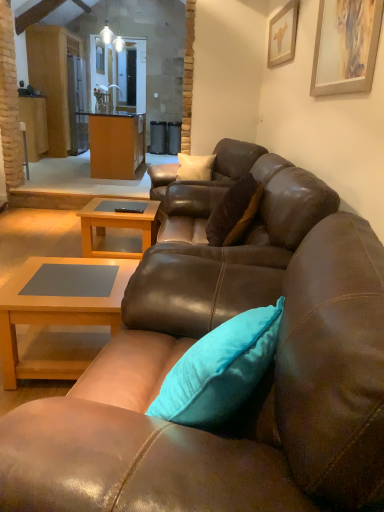
Question: Considering the relative sizes of wooden picture frame at upper right, which is the 1th picture frame from front to back, and wooden picture frame at upper right, which is the 2th picture frame in front-to-back order, in the image provided, is wooden picture frame at upper right, which is the 1th picture frame from front to back, thinner than wooden picture frame at upper right, which is the 2th picture frame in front-to-back order,?

Choices:
 (A) no
 (B) yes

Answer: (A)

Question: Considering the relative positions of wooden picture frame at upper right, the 1th picture frame positioned from the bottom, and wooden picture frame at upper right, the second picture frame ordered from the bottom, in the image provided, is wooden picture frame at upper right, the 1th picture frame positioned from the bottom, to the left of wooden picture frame at upper right, the second picture frame ordered from the bottom, from the viewer's perspective?

Choices:
 (A) no
 (B) yes

Answer: (A)

Question: From a real-world perspective, is wooden picture frame at upper right, placed as the second picture frame when sorted from back to front, under wooden picture frame at upper right, placed as the first picture frame when sorted from top to bottom?

Choices:
 (A) no
 (B) yes

Answer: (B)

Question: Would you say wooden picture frame at upper right, the 1th picture frame positioned from the bottom, contains wooden picture frame at upper right, placed as the first picture frame when sorted from top to bottom?

Choices:
 (A) no
 (B) yes

Answer: (A)

Question: Is wooden picture frame at upper right, the 1th picture frame positioned from the bottom, oriented away from wooden picture frame at upper right, placed as the first picture frame when sorted from top to bottom?

Choices:
 (A) yes
 (B) no

Answer: (B)

Question: Is wooden picture frame at upper right, placed as the second picture frame when sorted from back to front, to the right of wooden picture frame at upper right, the second picture frame ordered from the bottom, from the viewer's perspective?

Choices:
 (A) no
 (B) yes

Answer: (B)

Question: Can you confirm if brown leather couch at center, acting as the second studio couch starting from the top, is positioned to the left of light brown wood coffee table at center, which is the second coffee table in bottom-to-top order?

Choices:
 (A) no
 (B) yes

Answer: (A)

Question: Can you confirm if brown leather couch at center, which ranks as the 1th studio couch in bottom-to-top order, is wider than light brown wood coffee table at center, which is counted as the 1th coffee table, starting from the top?

Choices:
 (A) no
 (B) yes

Answer: (B)

Question: Is brown leather couch at center, acting as the second studio couch starting from the top, taller than light brown wood coffee table at center, which is counted as the 1th coffee table, starting from the top?

Choices:
 (A) no
 (B) yes

Answer: (B)

Question: Is brown leather couch at center, positioned as the 2th studio couch in back-to-front order, oriented away from light brown wood coffee table at center, the 1th coffee table viewed from the back?

Choices:
 (A) yes
 (B) no

Answer: (B)

Question: Does brown leather couch at center, which ranks as the 1th studio couch in bottom-to-top order, appear on the right side of light brown wood coffee table at center, the second coffee table from the front?

Choices:
 (A) no
 (B) yes

Answer: (B)

Question: Is brown leather couch at center, acting as the second studio couch starting from the top, aimed at light brown wood coffee table at center, which is the second coffee table in bottom-to-top order?

Choices:
 (A) yes
 (B) no

Answer: (B)

Question: Can you confirm if matte wood cabinet at center is bigger than wooden picture frame at upper right, which is the 1th picture frame from front to back?

Choices:
 (A) yes
 (B) no

Answer: (A)